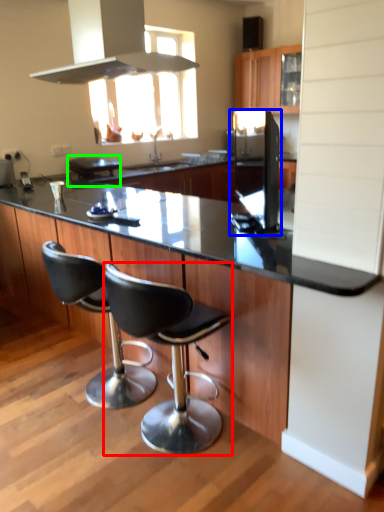
Question: Based on their relative distances, which object is farther from chair (highlighted by a red box)? Choose from appliance (highlighted by a blue box) and appliance (highlighted by a green box).

Choices:
 (A) appliance
 (B) appliance

Answer: (B)